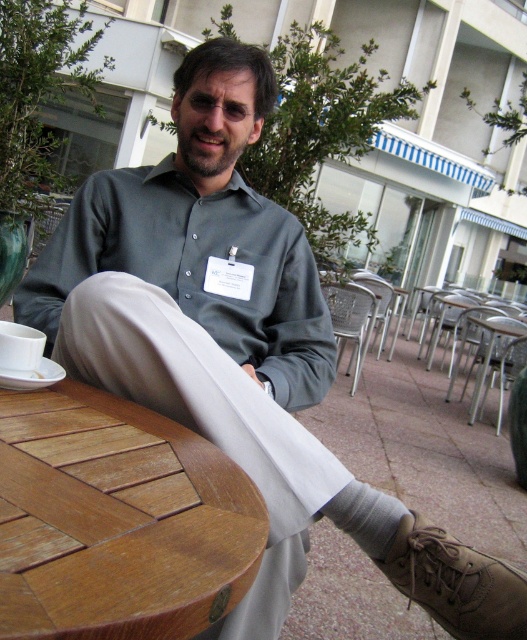
You are standing in front of the wooden table where the man is sitting. There is a point at coordinates point (x=204, y=572). If you want to place a 12 inch ruler on the table so that one end touches this point, will the ruler fit entirely on the table without hanging off the edge?

The distance of point (x=204, y=572) from viewer is 16.90 inches. Since the ruler is 12 inches long, placing it from the edge of the table towards the point would leave 4.9 inches between the ruler and the point, so the ruler would fit entirely on the table without hanging off the edge.

You are taking a photo of the man at the wooden table in the outdoor setting. The camera is positioned so that you can see both points marked in the image. Which point, point (43, 506) or point (418, 548), appears closer to the camera in the photo?

Point (43, 506) appears closer to the camera than point (418, 548).